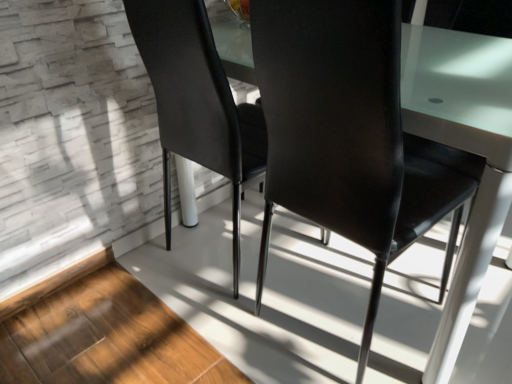
Question: In which direction should I rotate to look at matte black chair at center, the 1th chair in the right-to-left sequence?

Choices:
 (A) left
 (B) right

Answer: (B)

Question: Is the position of matte black chair at center, the 1th chair in the right-to-left sequence, less distant than that of matte black chair at center, arranged as the second chair when viewed from the right?

Choices:
 (A) no
 (B) yes

Answer: (B)

Question: Is matte black chair at center, arranged as the second chair when viewed from the left, oriented away from matte black chair at center, the 1th chair in the left-to-right sequence?

Choices:
 (A) no
 (B) yes

Answer: (A)

Question: From the image's perspective, does matte black chair at center, the 1th chair in the right-to-left sequence, appear lower than matte black chair at center, the 1th chair in the left-to-right sequence?

Choices:
 (A) yes
 (B) no

Answer: (A)

Question: Is matte black chair at center, the 1th chair in the right-to-left sequence, completely or partially outside of matte black chair at center, the 1th chair in the left-to-right sequence?

Choices:
 (A) yes
 (B) no

Answer: (A)

Question: Can you confirm if matte black chair at center, the 1th chair in the right-to-left sequence, is positioned to the left of matte black chair at center, arranged as the second chair when viewed from the right?

Choices:
 (A) no
 (B) yes

Answer: (A)

Question: From the image's perspective, is matte black chair at center, the 1th chair in the right-to-left sequence, above matte black chair at center, the 1th chair in the left-to-right sequence?

Choices:
 (A) no
 (B) yes

Answer: (A)

Question: Considering the relative sizes of matte black chair at center, arranged as the second chair when viewed from the right, and matte black chair at center, arranged as the second chair when viewed from the left, in the image provided, is matte black chair at center, arranged as the second chair when viewed from the right, shorter than matte black chair at center, arranged as the second chair when viewed from the left,?

Choices:
 (A) yes
 (B) no

Answer: (A)

Question: Considering the relative positions of matte black chair at center, the 1th chair in the left-to-right sequence, and matte black chair at center, the 1th chair in the right-to-left sequence, in the image provided, is matte black chair at center, the 1th chair in the left-to-right sequence, in front of matte black chair at center, the 1th chair in the right-to-left sequence,?

Choices:
 (A) yes
 (B) no

Answer: (B)

Question: Can you confirm if matte black chair at center, the 1th chair in the left-to-right sequence, is positioned to the left of matte black chair at center, arranged as the second chair when viewed from the left?

Choices:
 (A) no
 (B) yes

Answer: (B)

Question: Is matte black chair at center, arranged as the second chair when viewed from the right, positioned behind matte black chair at center, arranged as the second chair when viewed from the left?

Choices:
 (A) no
 (B) yes

Answer: (B)

Question: Would you say matte black chair at center, the 1th chair in the left-to-right sequence, contains matte black chair at center, arranged as the second chair when viewed from the left?

Choices:
 (A) no
 (B) yes

Answer: (A)

Question: From the image's perspective, is matte black chair at center, the 1th chair in the left-to-right sequence, above matte black chair at center, the 1th chair in the right-to-left sequence?

Choices:
 (A) yes
 (B) no

Answer: (A)

Question: Is matte black chair at center, the 1th chair in the left-to-right sequence, taller or shorter than matte black chair at center, arranged as the second chair when viewed from the left?

Choices:
 (A) short
 (B) tall

Answer: (A)